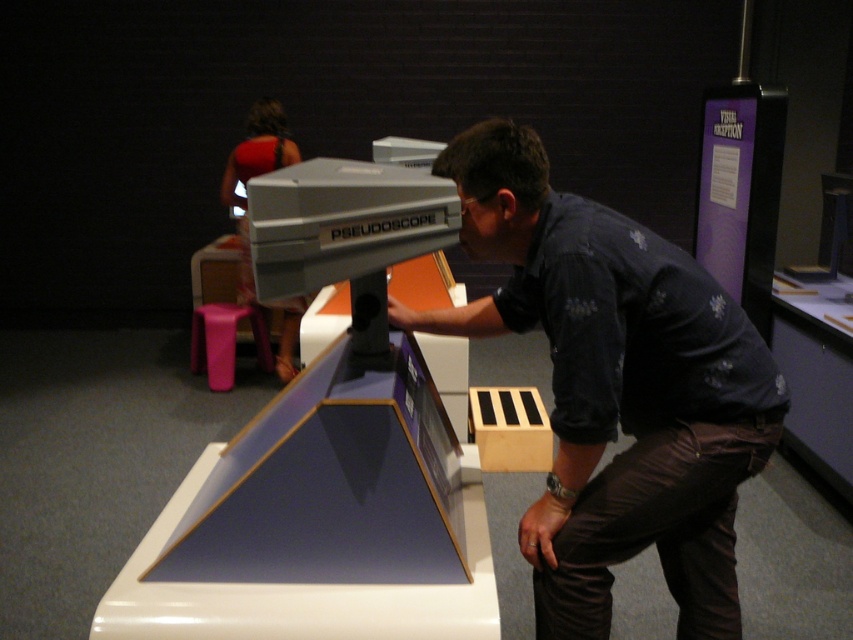
Is point (569, 292) in front of point (215, 387)?

Yes, point (569, 292) is closer to viewer.

Is dark blue shirt at center to the left of purple plastic stool at lower left from the viewer's perspective?

Incorrect, dark blue shirt at center is not on the left side of purple plastic stool at lower left.

Between point (625, 342) and point (215, 362), which one is positioned in front?

Positioned in front is point (625, 342).

The height and width of the screenshot is (640, 853). Identify the location of dark blue shirt at center. (614, 387).